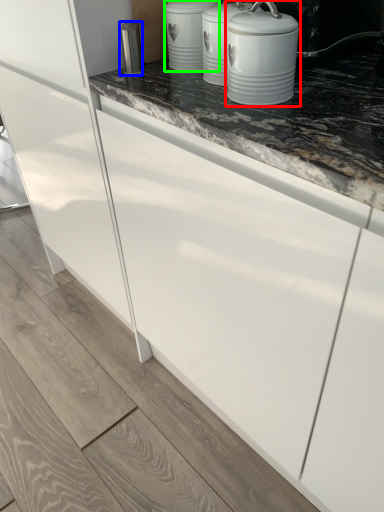
Question: Which object is positioned farthest from home appliance (highlighted by a red box)? Select from appliance (highlighted by a blue box) and kitchen appliance (highlighted by a green box).

Choices:
 (A) appliance
 (B) kitchen appliance

Answer: (A)